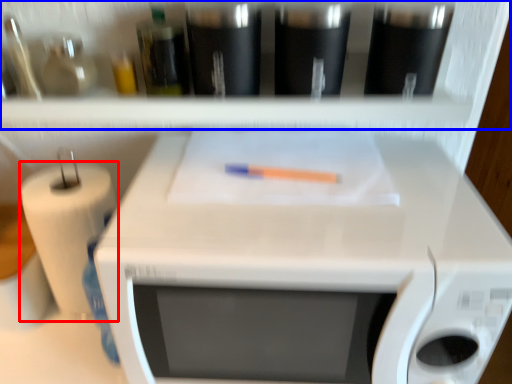
Question: Which point is further to the camera, paper towel (highlighted by a red box) or shelf (highlighted by a blue box)?

Choices:
 (A) paper towel
 (B) shelf

Answer: (A)